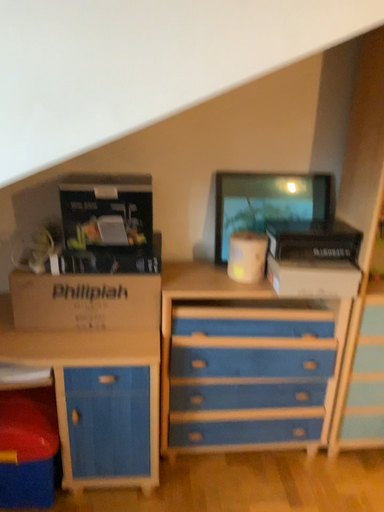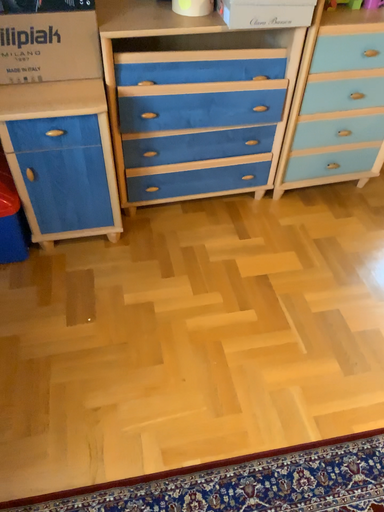
Question: Which way did the camera rotate in the video?

Choices:
 (A) rotated upward
 (B) rotated downward

Answer: (B)